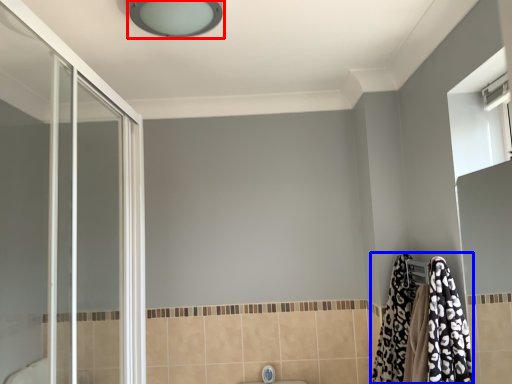
Question: Which object is further to the camera taking this photo, light fixture (highlighted by a red box) or bathrobe (highlighted by a blue box)?

Choices:
 (A) light fixture
 (B) bathrobe

Answer: (B)